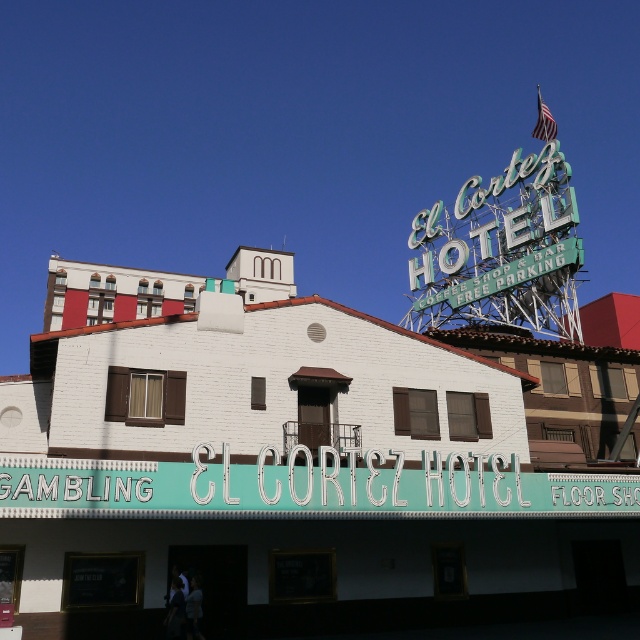
You are standing in front of the El Cortez Hotel and want to take a photo of the white brick theater at center. If your camera can focus on objects up to 30 meters away, will you be able to capture a clear photo?

The distance between you and the white brick theater at center is 26.71 meters, which is within the camera focus range of up to 30 meters. Therefore, you can capture a clear photo.